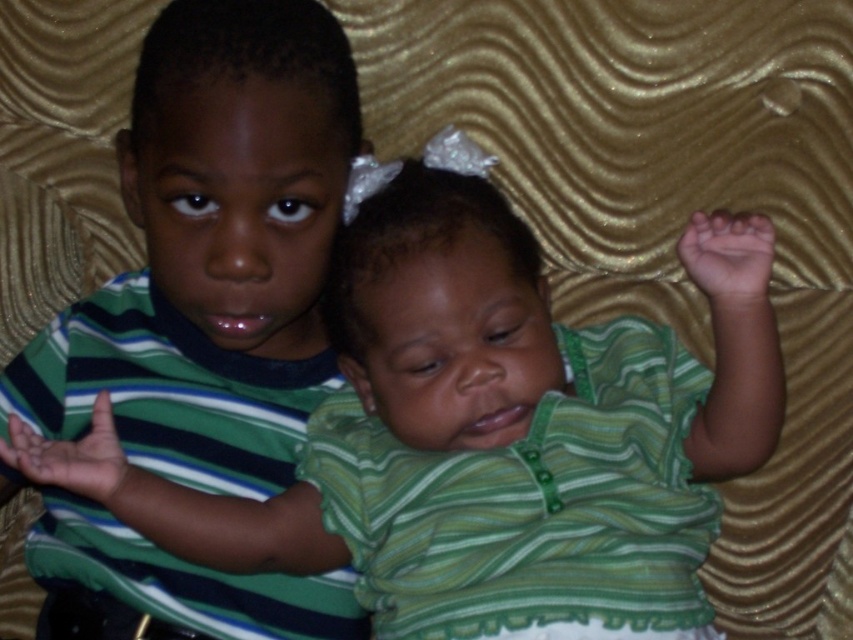
In the scene shown: You are a photographer setting up a shot with two points marked in the scene. The points are at coordinates point (198, 509) and point (335, 112). Which point is closer to the camera?

Point (198, 509) is closer to the camera than point (335, 112) because it is further to the camera according to the description.

You are a photographer setting up a shoot with two children wearing green striped shirts. The scene has a gold fabric backdrop. You need to ensure both shirts are visible in the frame. Given that the green striped shirt at center is wider than the green striped shirt at left, which shirt should you focus on to capture the full width of both shirts without cropping either?

To capture the full width of both shirts without cropping, focus on the green striped shirt at center since it is wider than the green striped shirt at left. Ensure the camera frame includes the entire width of the wider shirt, and the narrower one will naturally fit within the same view.